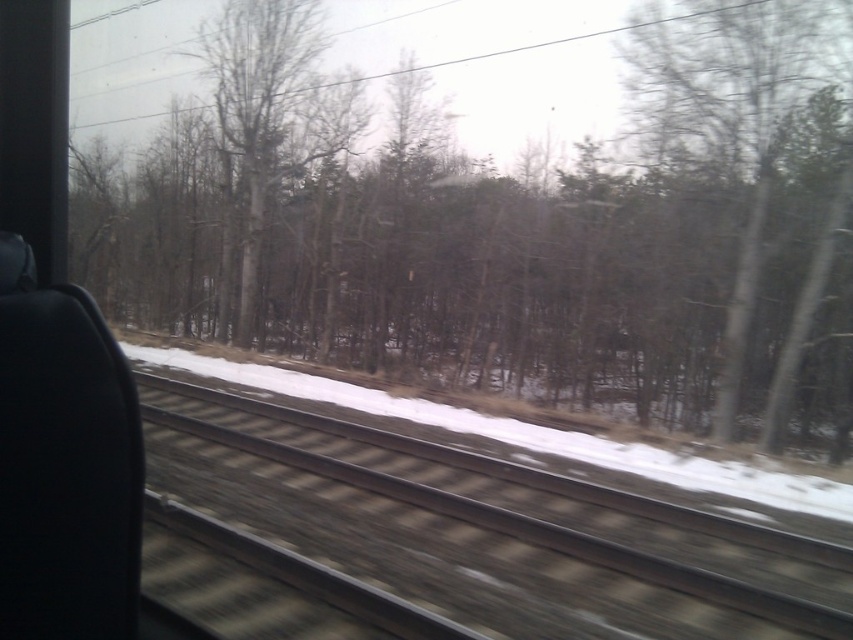
Between brown/dry wood at center and brown textured track at center, which one appears on the left side from the viewer's perspective?

brown/dry wood at center is more to the left.

Based on the photo, can you confirm if brown/dry wood at center is positioned below brown textured track at center?

No.

Is point (358, 314) less distant than point (813, 604)?

No, (358, 314) is further to viewer.

At what (x,y) coordinates should I click in order to perform the action: click on brown/dry wood at center. Please return your answer as a coordinate pair (x, y). The height and width of the screenshot is (640, 853). Looking at the image, I should click on [x=508, y=236].